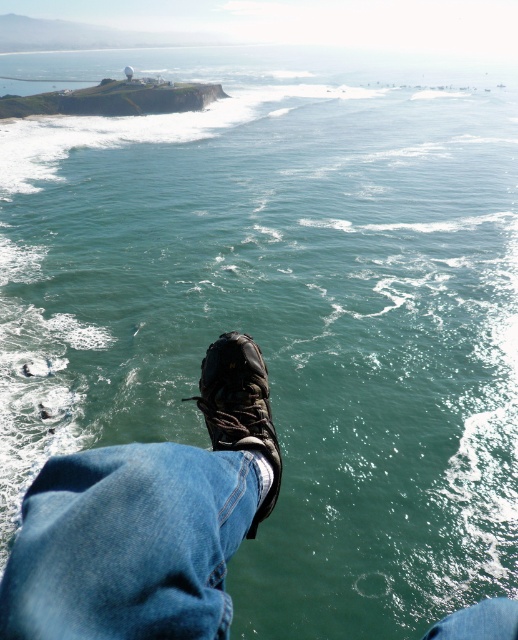
Question: Which of the following is the closest to the observer?

Choices:
 (A) (37, 488)
 (B) (210, 355)

Answer: (A)

Question: Does dark brown leather shoe at center appear under black leather boot at center?

Choices:
 (A) yes
 (B) no

Answer: (A)

Question: Where is dark brown leather shoe at center located in relation to smooth concrete cliff at upper left in the image?

Choices:
 (A) below
 (B) above

Answer: (A)

Question: Can you confirm if dark brown leather shoe at center is thinner than black leather boot at center?

Choices:
 (A) yes
 (B) no

Answer: (B)

Question: Which object appears closest to the camera in this image?

Choices:
 (A) black leather boot at center
 (B) smooth concrete cliff at upper left

Answer: (A)

Question: Which of the following is the closest to the observer?

Choices:
 (A) smooth concrete cliff at upper left
 (B) black leather boot at center
 (C) dark brown leather shoe at center

Answer: (C)